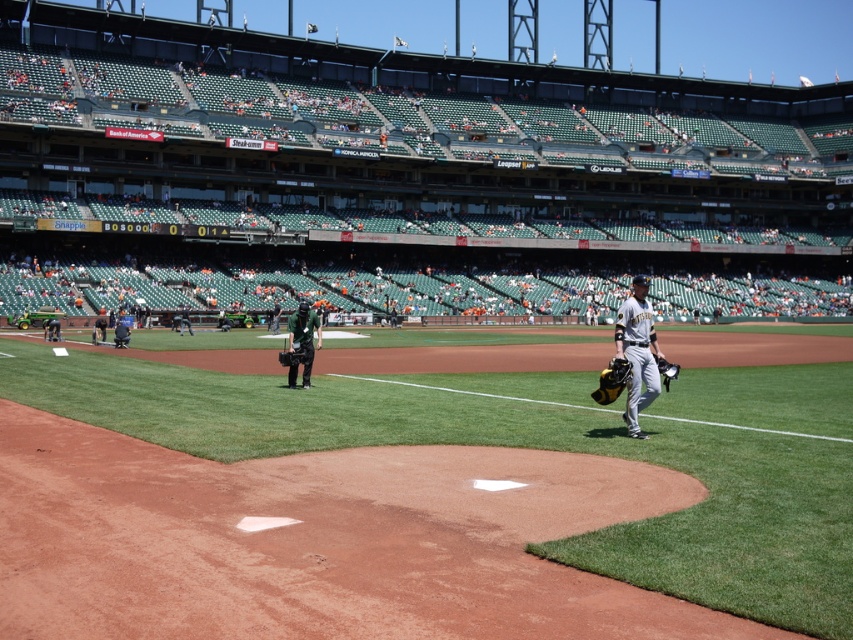
Is point (643, 140) more distant than point (282, 358)?

Yes, it is.

Identify the location of gray matte uniform at center. The height and width of the screenshot is (640, 853). (405, 176).

Does gray uniformed baseball player at center have a greater height compared to green fabric camera at center?

Yes.

Is point (639, 392) positioned behind point (288, 372)?

No.

The image size is (853, 640). I want to click on gray uniformed baseball player at center, so click(x=637, y=353).

At what (x,y) coordinates should I click in order to perform the action: click on gray uniformed baseball player at center. Please return your answer as a coordinate pair (x, y). Looking at the image, I should click on (637, 353).

Looking at this image, does gray matte uniform at center appear under gray uniformed baseball player at center?

No.

Who is more distant from viewer, (x=393, y=182) or (x=625, y=358)?

Positioned behind is point (x=393, y=182).

I want to click on gray matte uniform at center, so click(405, 176).